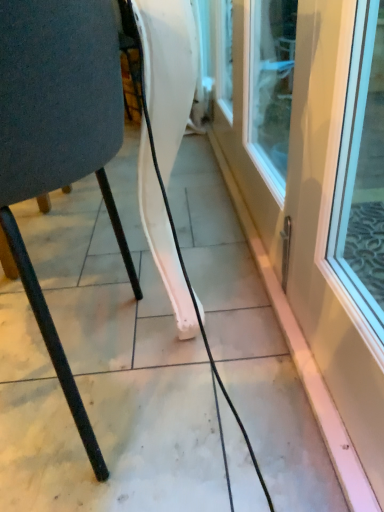
Measure the distance between point (x=61, y=59) and camera.

Point (x=61, y=59) and camera are 17.95 inches apart from each other.

Where is `matte black chair at left`? This screenshot has height=512, width=384. matte black chair at left is located at coordinates (59, 137).

What do you see at coordinates (59, 137) in the screenshot? The width and height of the screenshot is (384, 512). I see `matte black chair at left` at bounding box center [59, 137].

Where is `white glossy door at right`? white glossy door at right is located at coordinates (315, 185).

Describe the element at coordinates (315, 185) in the screenshot. The height and width of the screenshot is (512, 384). I see `white glossy door at right` at that location.

This screenshot has height=512, width=384. I want to click on matte black chair at left, so click(x=59, y=137).

Considering the positions of objects white glossy door at right and matte black chair at left in the image provided, who is more to the left, white glossy door at right or matte black chair at left?

matte black chair at left is more to the left.

Which is in front, white glossy door at right or matte black chair at left?

white glossy door at right is in front.

Is point (355, 15) closer or farther from the camera than point (23, 78)?

Point (355, 15).

From the image's perspective, is white glossy door at right above matte black chair at left?

Indeed, from the image's perspective, white glossy door at right is shown above matte black chair at left.

From a real-world perspective, between white glossy door at right and matte black chair at left, who is vertically higher?

matte black chair at left is physically above.

Is white glossy door at right wider or thinner than matte black chair at left?

Considering their sizes, white glossy door at right looks slimmer than matte black chair at left.

From the picture: Considering the sizes of objects white glossy door at right and matte black chair at left in the image provided, who is shorter, white glossy door at right or matte black chair at left?

With less height is white glossy door at right.

Based on their sizes in the image, would you say white glossy door at right is bigger or smaller than matte black chair at left?

Clearly, white glossy door at right is smaller in size than matte black chair at left.

Is matte black chair at left a part of white glossy door at right?

No, matte black chair at left is not inside white glossy door at right.

Are white glossy door at right and matte black chair at left located far from each other?

That's not correct — white glossy door at right is a little close to matte black chair at left.

Is matte black chair at left at the back of white glossy door at right?

Yes.

Measure the distance from white glossy door at right to matte black chair at left.

28.49 inches.

Locate an element on the screen. Image resolution: width=384 pixels, height=512 pixels. door below the matte black chair at left (from a real-world perspective) is located at coordinates (315, 185).

From the picture: Is matte black chair at left to the left of white glossy door at right from the viewer's perspective?

Indeed, matte black chair at left is positioned on the left side of white glossy door at right.

Between matte black chair at left and white glossy door at right, which one is positioned in front?

Positioned in front is white glossy door at right.

Which point is more distant from viewer, (x=48, y=38) or (x=324, y=234)?

Positioned behind is point (x=324, y=234).

From the image's perspective, which object appears higher, matte black chair at left or white glossy door at right?

white glossy door at right.

From a real-world perspective, is matte black chair at left positioned above or below white glossy door at right?

matte black chair at left is situated higher than white glossy door at right in the real world.

Which object is wider, matte black chair at left or white glossy door at right?

matte black chair at left.

Who is shorter, matte black chair at left or white glossy door at right?

Standing shorter between the two is white glossy door at right.

In terms of size, does matte black chair at left appear bigger or smaller than white glossy door at right?

In the image, matte black chair at left appears to be larger than white glossy door at right.

Does matte black chair at left contain white glossy door at right?

Definitely not — white glossy door at right is not inside matte black chair at left.

Are matte black chair at left and white glossy door at right making contact?

matte black chair at left is not next to white glossy door at right, and they're not touching.

Is matte black chair at left aimed at white glossy door at right?

No, matte black chair at left is not facing towards white glossy door at right.

How many degrees apart are the facing directions of matte black chair at left and white glossy door at right?

89.9 degrees.

I want to click on chair located above the white glossy door at right (from a real-world perspective), so click(59, 137).

The width and height of the screenshot is (384, 512). Identify the location of door in front of the matte black chair at left. (315, 185).

At what (x,y) coordinates should I click in order to perform the action: click on chair above the white glossy door at right (from a real-world perspective). Please return your answer as a coordinate pair (x, y). This screenshot has width=384, height=512. Looking at the image, I should click on pyautogui.click(x=59, y=137).